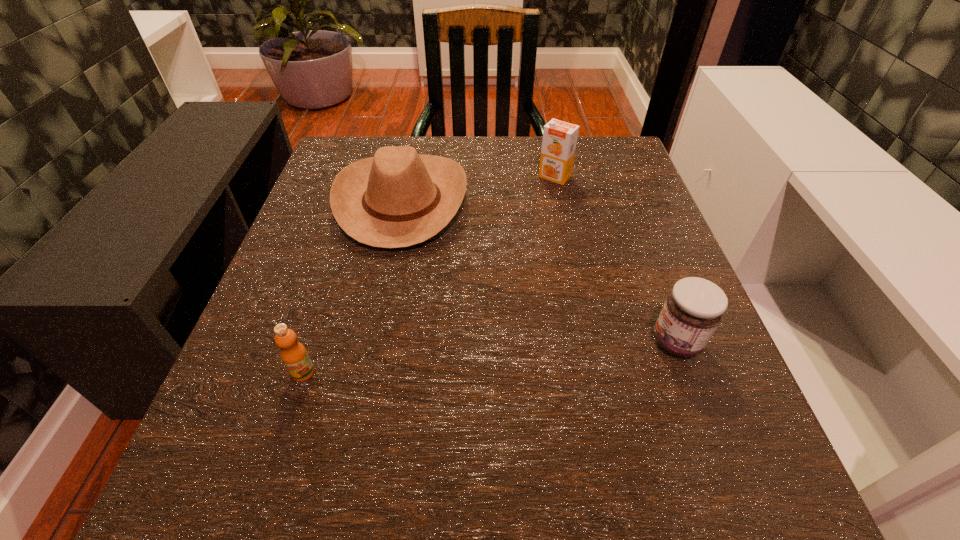
At what (x,y) coordinates should I click in order to perform the action: click on vacant area located 0.090m on the front label of the rightmost object. Please return your answer as a coordinate pair (x, y). The height and width of the screenshot is (540, 960). Looking at the image, I should click on (592, 342).

Locate an element on the screen. Image resolution: width=960 pixels, height=540 pixels. vacant position located 0.180m on the front label of the nearer orange juice is located at coordinates (254, 523).

I want to click on orange juice that is at the far edge, so click(559, 141).

The height and width of the screenshot is (540, 960). In order to click on cowboy hat that is at the far edge in this screenshot , I will do `click(398, 198)`.

Identify the location of cowboy hat that is at the left edge. The image size is (960, 540). (398, 198).

Locate an element on the screen. This screenshot has width=960, height=540. orange juice at the left edge is located at coordinates (293, 354).

You are a GUI agent. You are given a task and a screenshot of the screen. Output one action in this format:
    pyautogui.click(x=<x>, y=<y>)
    Task: Click on the orange juice that is at the right edge
    The image size is (960, 540).
    Given the screenshot: What is the action you would take?
    pyautogui.click(x=559, y=141)

This screenshot has height=540, width=960. I want to click on jam situated at the right edge, so click(x=694, y=308).

The width and height of the screenshot is (960, 540). Identify the location of object present at the far left corner. pos(398,198).

You are a GUI agent. You are given a task and a screenshot of the screen. Output one action in this format:
    pyautogui.click(x=<x>, y=<y>)
    Task: Click on the object at the far right corner
    Image resolution: width=960 pixels, height=540 pixels.
    Given the screenshot: What is the action you would take?
    pyautogui.click(x=559, y=141)